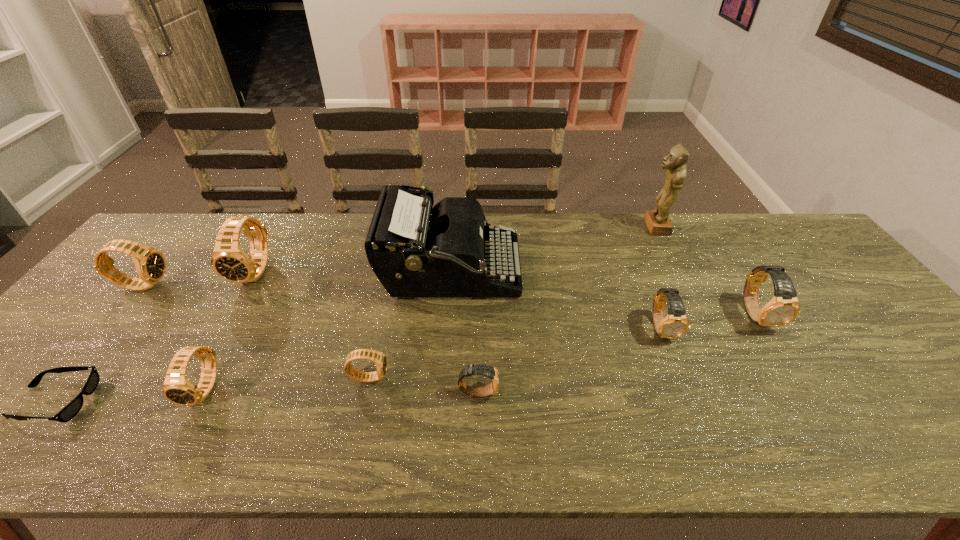
The width and height of the screenshot is (960, 540). I want to click on the eighth object from left to right, so click(675, 324).

At what (x,y) coordinates should I click in order to perform the action: click on the sixth watch from left to right. Please return your answer as a coordinate pair (x, y). This screenshot has height=540, width=960. Looking at the image, I should click on (675, 324).

Find the location of a particular element. the nearest gold watch is located at coordinates (486, 370).

Where is `the fifth watch from left to right`? the fifth watch from left to right is located at coordinates (486, 370).

The width and height of the screenshot is (960, 540). Identify the location of the rightmost black watch. (379, 358).

Locate an element on the screen. the fourth watch from right to left is located at coordinates (379, 358).

Identify the location of vacant space situated on the front-facing side of the ninth object from left to right. This screenshot has height=540, width=960. (574, 227).

Image resolution: width=960 pixels, height=540 pixels. I want to click on vacant space situated on the front-facing side of the ninth object from left to right, so click(x=544, y=227).

What are the coordinates of `free space located on the front-facing side of the ninth object from left to right` in the screenshot? It's located at [625, 227].

I want to click on free spot located on the typing side of the typewriter, so click(x=620, y=271).